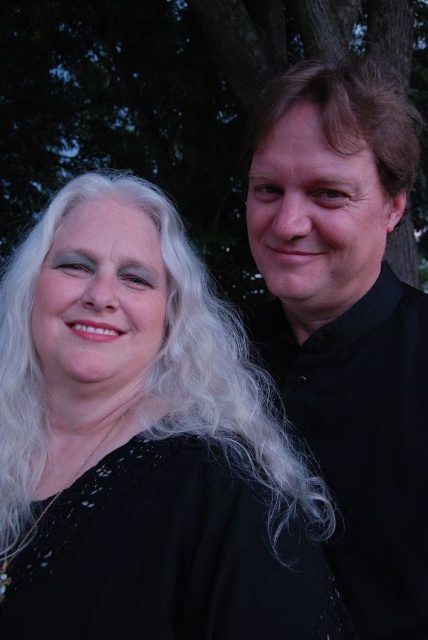
Question: Is black smooth shirt at right in front of black lace dress at center?

Choices:
 (A) no
 (B) yes

Answer: (A)

Question: Can you confirm if black matte dress at center is bigger than black lace dress at center?

Choices:
 (A) no
 (B) yes

Answer: (B)

Question: Which of the following is the farthest from the observer?

Choices:
 (A) (35, 81)
 (B) (279, 602)
 (C) (136, 513)

Answer: (A)

Question: Which point is closer to the camera taking this photo?

Choices:
 (A) coord(305,116)
 (B) coord(184,432)

Answer: (B)

Question: Is black smooth shirt at right below dark brown wood tree at upper center?

Choices:
 (A) no
 (B) yes

Answer: (B)

Question: Which object is positioned closest to the black smooth shirt at right?

Choices:
 (A) black lace dress at center
 (B) dark brown wood tree at upper center
 (C) black matte dress at center

Answer: (C)